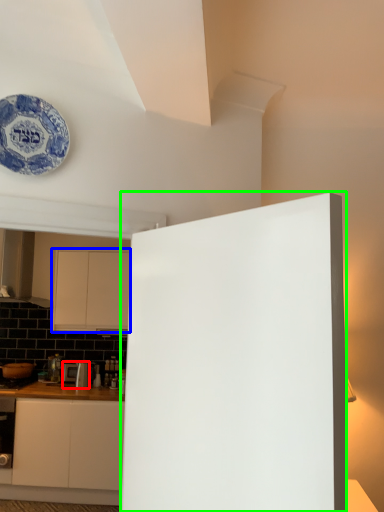
Question: Considering the real-world distances, which object is farthest from appliance (highlighted by a red box)? cabinetry (highlighted by a blue box) or door (highlighted by a green box)?

Choices:
 (A) cabinetry
 (B) door

Answer: (B)